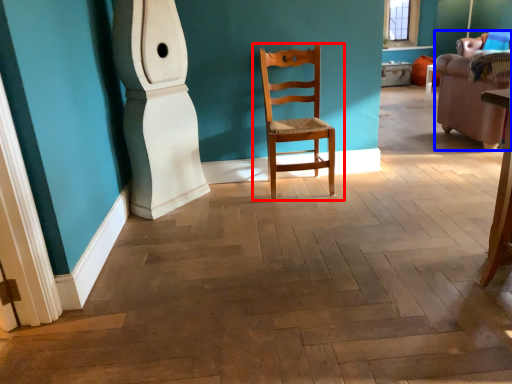
Question: Among these objects, which one is nearest to the camera, chair (highlighted by a red box) or armchair (highlighted by a blue box)?

Choices:
 (A) chair
 (B) armchair

Answer: (A)